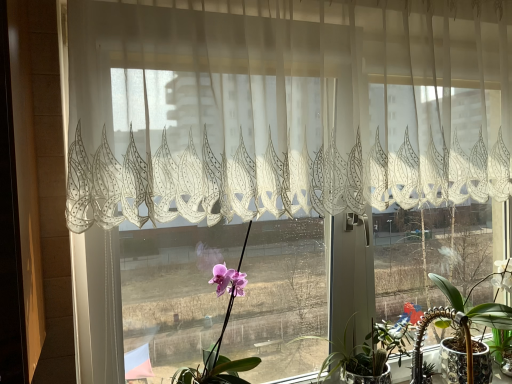
Question: From the image's perspective, is translucent white lace curtain at upper center over white glossy pot at lower right, marked as the third houseplant in a left-to-right arrangement?

Choices:
 (A) yes
 (B) no

Answer: (A)

Question: Does translucent white lace curtain at upper center have a greater width compared to white glossy pot at lower right, the 1th houseplant in the right-to-left sequence?

Choices:
 (A) no
 (B) yes

Answer: (A)

Question: Is translucent white lace curtain at upper center to the left of white glossy pot at lower right, the 1th houseplant in the right-to-left sequence, from the viewer's perspective?

Choices:
 (A) yes
 (B) no

Answer: (A)

Question: Does translucent white lace curtain at upper center have a greater height compared to white glossy pot at lower right, marked as the third houseplant in a left-to-right arrangement?

Choices:
 (A) no
 (B) yes

Answer: (B)

Question: Is translucent white lace curtain at upper center not within white glossy pot at lower right, the 1th houseplant in the right-to-left sequence?

Choices:
 (A) yes
 (B) no

Answer: (A)

Question: Is translucent white lace curtain at upper center facing away from white glossy pot at lower right, the 1th houseplant in the right-to-left sequence?

Choices:
 (A) yes
 (B) no

Answer: (B)

Question: Considering the relative positions of white glossy pot at lower right, marked as the third houseplant in a left-to-right arrangement, and pink matte orchid at center, which is the 3th houseplant in right-to-left order, in the image provided, is white glossy pot at lower right, marked as the third houseplant in a left-to-right arrangement, to the left of pink matte orchid at center, which is the 3th houseplant in right-to-left order, from the viewer's perspective?

Choices:
 (A) no
 (B) yes

Answer: (A)

Question: Considering the relative sizes of white glossy pot at lower right, the 1th houseplant in the right-to-left sequence, and pink matte orchid at center, which ranks as the 1th houseplant in left-to-right order, in the image provided, is white glossy pot at lower right, the 1th houseplant in the right-to-left sequence, shorter than pink matte orchid at center, which ranks as the 1th houseplant in left-to-right order,?

Choices:
 (A) yes
 (B) no

Answer: (A)

Question: Considering the relative sizes of white glossy pot at lower right, marked as the third houseplant in a left-to-right arrangement, and pink matte orchid at center, which is the 3th houseplant in right-to-left order, in the image provided, is white glossy pot at lower right, marked as the third houseplant in a left-to-right arrangement, wider than pink matte orchid at center, which is the 3th houseplant in right-to-left order,?

Choices:
 (A) no
 (B) yes

Answer: (A)

Question: Can you confirm if white glossy pot at lower right, the 1th houseplant in the right-to-left sequence, is positioned to the right of pink matte orchid at center, which ranks as the 1th houseplant in left-to-right order?

Choices:
 (A) no
 (B) yes

Answer: (B)

Question: Considering the relative sizes of white glossy pot at lower right, the 1th houseplant in the right-to-left sequence, and pink matte orchid at center, which ranks as the 1th houseplant in left-to-right order, in the image provided, is white glossy pot at lower right, the 1th houseplant in the right-to-left sequence, taller than pink matte orchid at center, which ranks as the 1th houseplant in left-to-right order,?

Choices:
 (A) no
 (B) yes

Answer: (A)

Question: Does white glossy pot at lower right, the 1th houseplant in the right-to-left sequence, come in front of pink matte orchid at center, which is the 3th houseplant in right-to-left order?

Choices:
 (A) no
 (B) yes

Answer: (A)

Question: From the image's perspective, is translucent white lace curtain at upper center located beneath green glossy succulent at lower right, the second houseplant positioned from the right?

Choices:
 (A) no
 (B) yes

Answer: (A)